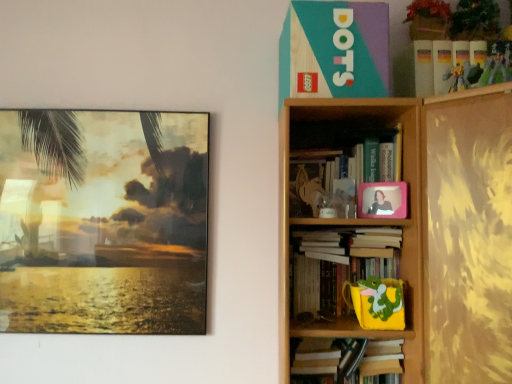
Question: Should I look upward or downward to see hardcover book at upper right, the first book when ordered from bottom to top?

Choices:
 (A) up
 (B) down

Answer: (B)

Question: Is wooden bookshelf at upper right positioned behind metallic silver toy at upper right, which appears as the third toy when viewed from the left?

Choices:
 (A) no
 (B) yes

Answer: (B)

Question: Can we say wooden bookshelf at upper right lies outside metallic silver toy at upper right, the third toy when ordered from back to front?

Choices:
 (A) no
 (B) yes

Answer: (B)

Question: Considering the relative sizes of wooden bookshelf at upper right and metallic silver toy at upper right, the third toy when ordered from back to front, in the image provided, is wooden bookshelf at upper right shorter than metallic silver toy at upper right, the third toy when ordered from back to front,?

Choices:
 (A) no
 (B) yes

Answer: (A)

Question: Is wooden bookshelf at upper right at the right side of metallic silver toy at upper right, which appears as the first toy when viewed from the front?

Choices:
 (A) yes
 (B) no

Answer: (B)

Question: Is wooden bookshelf at upper right looking in the opposite direction of metallic silver toy at upper right, which appears as the first toy when viewed from the front?

Choices:
 (A) no
 (B) yes

Answer: (A)

Question: Are wooden bookshelf at upper right and metallic silver toy at upper right, which is counted as the first toy, starting from the right, making contact?

Choices:
 (A) yes
 (B) no

Answer: (B)

Question: Considering the relative sizes of yellow matte cup at lower right, which appears as the first toy when viewed from the back, and plastic action figure at upper right, the 2th toy when ordered from right to left, in the image provided, is yellow matte cup at lower right, which appears as the first toy when viewed from the back, smaller than plastic action figure at upper right, the 2th toy when ordered from right to left,?

Choices:
 (A) yes
 (B) no

Answer: (B)

Question: Is plastic action figure at upper right, which ranks as the second toy in front-to-back order, surrounded by yellow matte cup at lower right, acting as the 1th toy starting from the bottom?

Choices:
 (A) no
 (B) yes

Answer: (A)

Question: Can you confirm if yellow matte cup at lower right, marked as the 3th toy in a right-to-left arrangement, is positioned to the right of plastic action figure at upper right, which ranks as the second toy in front-to-back order?

Choices:
 (A) no
 (B) yes

Answer: (A)

Question: Does yellow matte cup at lower right, the first toy when ordered from left to right, have a greater width compared to plastic action figure at upper right, which is the 1th toy from top to bottom?

Choices:
 (A) no
 (B) yes

Answer: (B)

Question: From a real-world perspective, is yellow matte cup at lower right, marked as the 3th toy in a right-to-left arrangement, positioned under plastic action figure at upper right, arranged as the 3th toy when ordered from the bottom, based on gravity?

Choices:
 (A) no
 (B) yes

Answer: (B)

Question: Is yellow matte cup at lower right, acting as the 1th toy starting from the bottom, oriented away from plastic action figure at upper right, which is the 2th toy from left to right?

Choices:
 (A) no
 (B) yes

Answer: (A)

Question: Is white paper at center, positioned as the 3th book in top-to-bottom order, oriented towards wooden bookshelf at upper right?

Choices:
 (A) no
 (B) yes

Answer: (B)